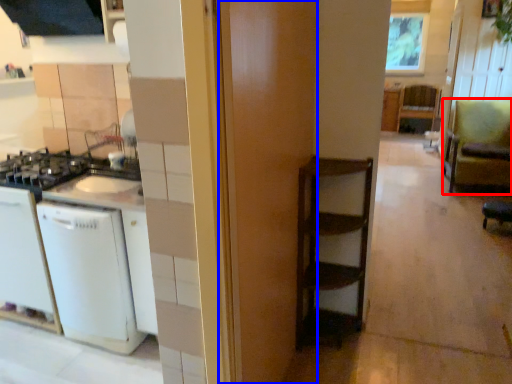
Question: Which object is further to the camera taking this photo, armchair (highlighted by a red box) or door (highlighted by a blue box)?

Choices:
 (A) armchair
 (B) door

Answer: (A)